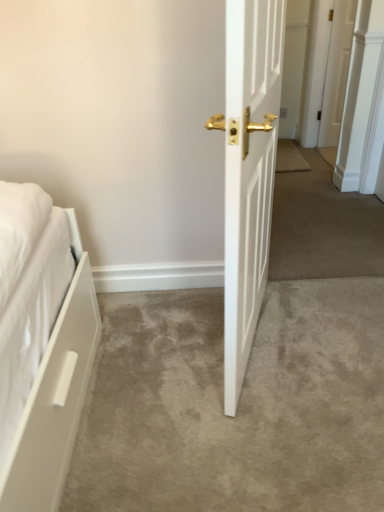
Locate an element on the screen. The height and width of the screenshot is (512, 384). beige carpet at center is located at coordinates (238, 405).

Image resolution: width=384 pixels, height=512 pixels. Describe the element at coordinates (238, 405) in the screenshot. I see `beige carpet at center` at that location.

Where is `beige carpet at center`? beige carpet at center is located at coordinates click(x=238, y=405).